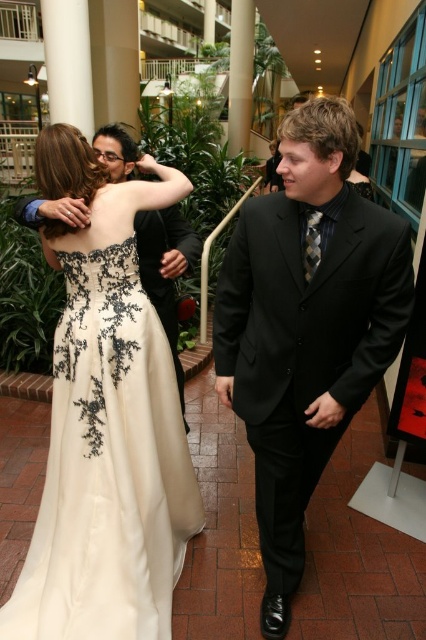
Is point (71, 298) closer to camera compared to point (288, 179)?

No.

Does ivory satin dress at upper left have a lesser width compared to black satin suit at center?

In fact, ivory satin dress at upper left might be wider than black satin suit at center.

From the picture: Who is more forward, (86, 532) or (363, 358)?

Point (363, 358) is in front.

Find the location of a particular element. ivory satin dress at upper left is located at coordinates (106, 422).